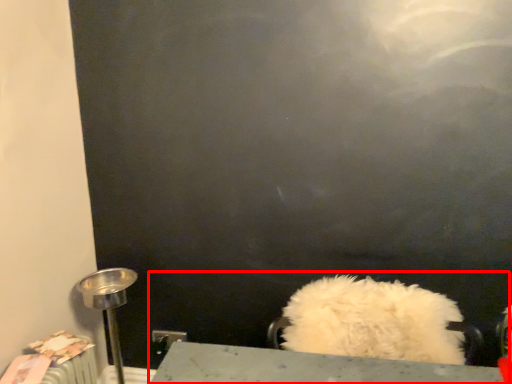
Question: Where is sink (annotated by the red box) located in relation to table lamp in the image?

Choices:
 (A) right
 (B) left

Answer: (A)